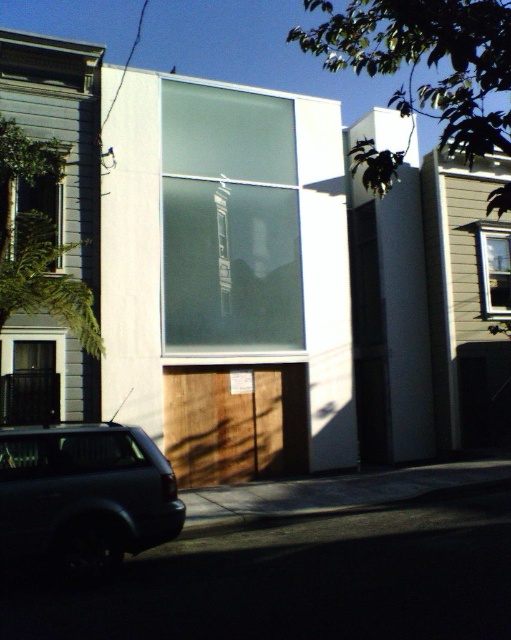
You are an architect analyzing the building facade. Which window has a greater width between the satin glass window at center and the clear glass window at left?

The satin glass window at center has a greater width than the clear glass window at left as stated in the description.

You are a delivery driver who needs to park your shiny black suv at lower left as close as possible to the satin glass window at center without blocking the entrance. Can you park the suv directly in front of the window?

The satin glass window at center is located above the shiny black suv at lower left, which means the suv is already parked directly beneath the window. Since the suv is already positioned under the window, it is as close as possible without blocking the entrance.